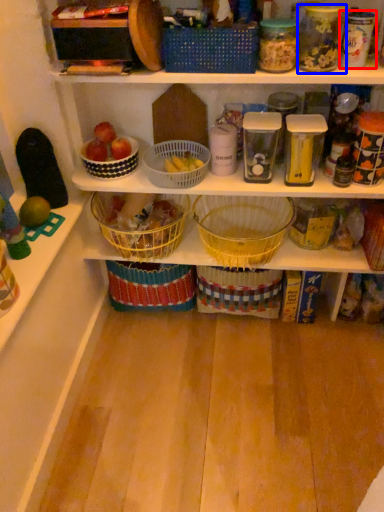
Question: Which of the following is the closest to the observer, glass jar (highlighted by a red box) or glass jar (highlighted by a blue box)?

Choices:
 (A) glass jar
 (B) glass jar

Answer: (B)